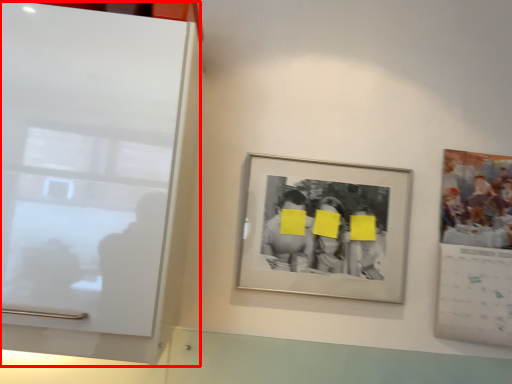
Question: In this image, where is glass door (annotated by the red box) located relative to picture frame?

Choices:
 (A) right
 (B) left

Answer: (B)